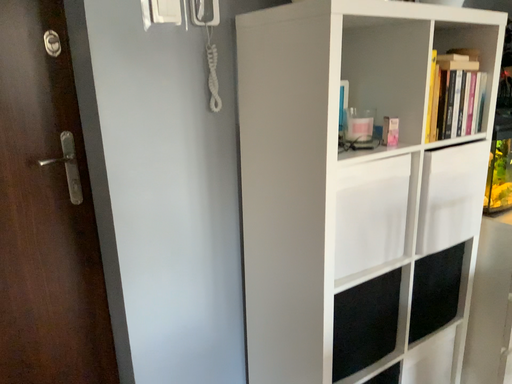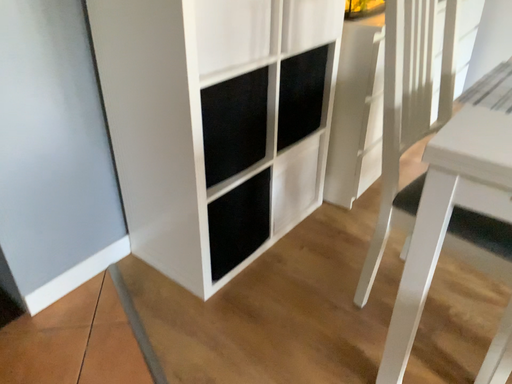
Question: Which way did the camera rotate in the video?

Choices:
 (A) rotated right
 (B) rotated left

Answer: (A)